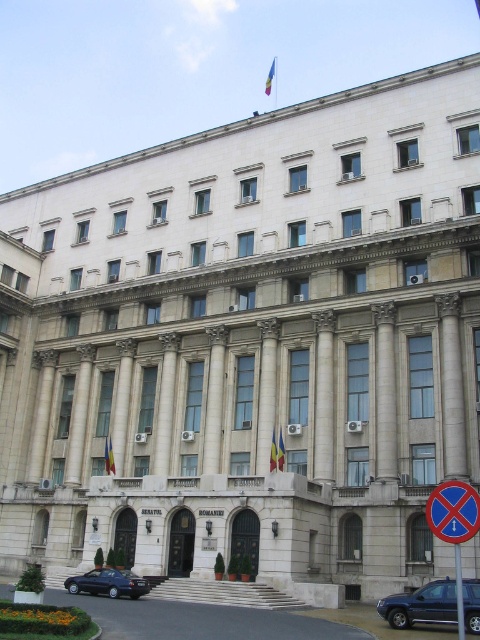
You are a visitor approaching the grand neoclassical building and notice two items near the entrance. The blue plastic sign at lower right and the yellow fabric flag at center. Which one is taller?

The blue plastic sign at lower right is taller than the yellow fabric flag at center.

You are a visitor arriving at the building and need to read the blue plastic sign at lower right and the yellow fabric flag at center. Which one is easier to read from a distance?

The blue plastic sign at lower right has a larger size compared to the yellow fabric flag at center, so it is easier to read from a distance.

You are a visitor approaching the grand neoclassical building and notice two blue items. The first is a blue plastic sign at lower right and the second is a blue fabric flag at center. Which of these two items is positioned lower in the scene?

The blue plastic sign at lower right is positioned lower than the blue fabric flag at center in the scene.